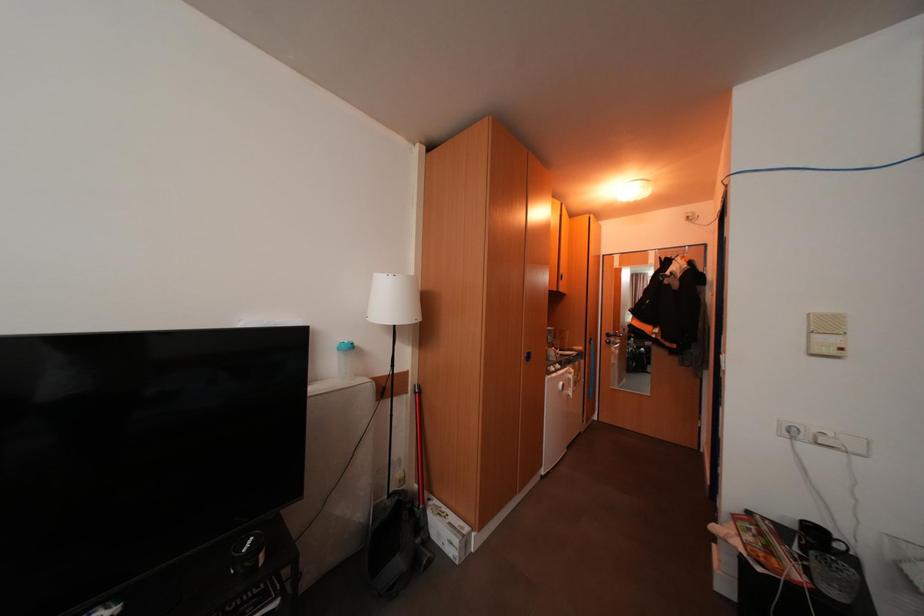
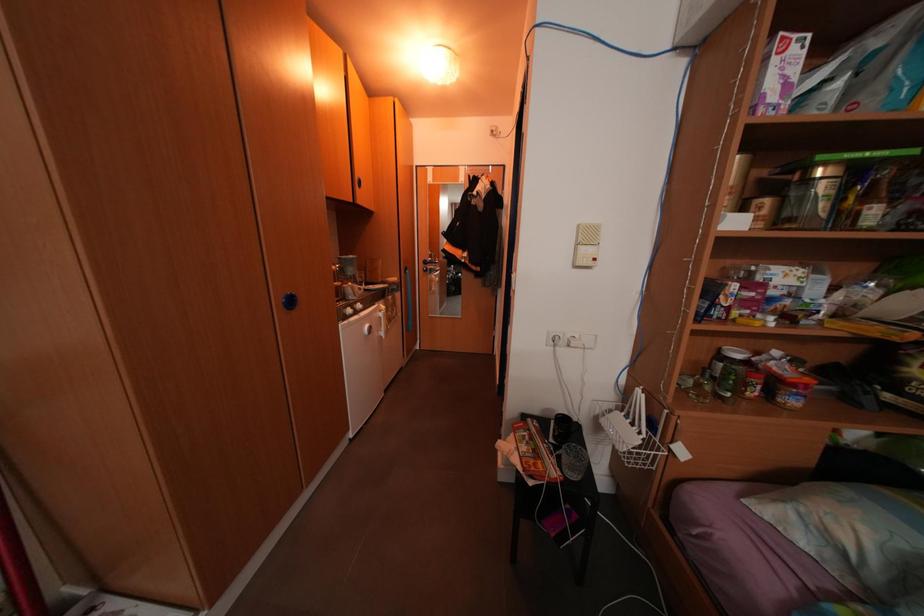
The first image is from the beginning of the video and the second image is from the end. How did the camera likely rotate when shooting the video?

The camera's rotation is toward right-down.